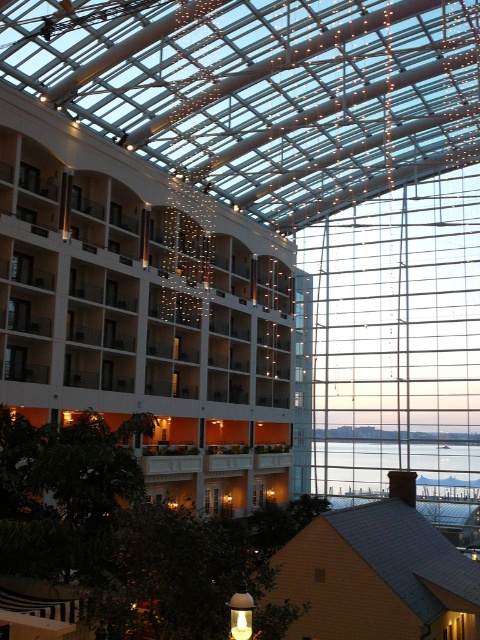
Which is below, white glossy hotel at center or yellow shingled roof at lower right?

yellow shingled roof at lower right is lower down.

Is white glossy hotel at center positioned before yellow shingled roof at lower right?

No, white glossy hotel at center is further to the viewer.

Find the location of a particular element. The image size is (480, 640). white glossy hotel at center is located at coordinates (145, 326).

Can you confirm if yellow shingled roof at lower right is shorter than transparent glass water at center?

No.

Is yellow shingled roof at lower right to the right of transparent glass water at center from the viewer's perspective?

No, yellow shingled roof at lower right is not to the right of transparent glass water at center.

Who is more distant from viewer, (x=404, y=604) or (x=332, y=449)?

The point (x=332, y=449) is more distant.

Identify the location of yellow shingled roof at lower right. (377, 573).

Is point (197, 364) in front of point (344, 481)?

That is True.

What are the coordinates of `white glossy hotel at center` in the screenshot? It's located at pos(145,326).